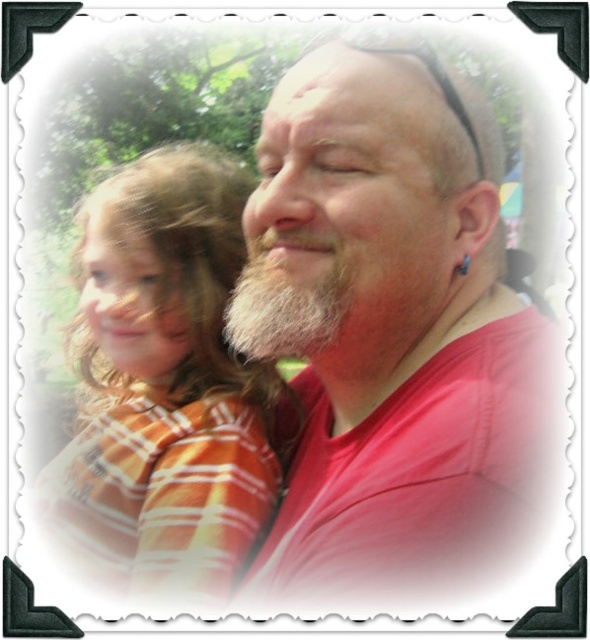
Which is behind, point (447, 340) or point (332, 314)?

Point (447, 340)

From the picture: Does white beard at center appear under whitewoollybeard at center?

Indeed, white beard at center is positioned under whitewoollybeard at center.

Between point (332, 554) and point (274, 296), which one is positioned behind?

Positioned behind is point (274, 296).

Image resolution: width=590 pixels, height=640 pixels. I want to click on white beard at center, so click(388, 316).

This screenshot has height=640, width=590. Identify the location of white beard at center. (388, 316).

Who is more forward, (x=278, y=564) or (x=149, y=164)?

Point (x=278, y=564) is more forward.

Between point (253, 356) and point (232, 253), which one is positioned behind?

The point (232, 253) is more distant.

Find the location of a particular element. This screenshot has width=590, height=640. white beard at center is located at coordinates [388, 316].

Where is `orange striped shirt at left`? orange striped shirt at left is located at coordinates (165, 384).

Does orange striped shirt at left appear on the right side of whitewoollybeard at center?

Incorrect, orange striped shirt at left is not on the right side of whitewoollybeard at center.

Which is in front, point (148, 365) or point (280, 291)?

Point (280, 291)

You are a GUI agent. You are given a task and a screenshot of the screen. Output one action in this format:
    pyautogui.click(x=<x>, y=<y>)
    Task: Click on the orange striped shirt at left
    The width and height of the screenshot is (590, 640).
    Given the screenshot: What is the action you would take?
    pyautogui.click(x=165, y=384)